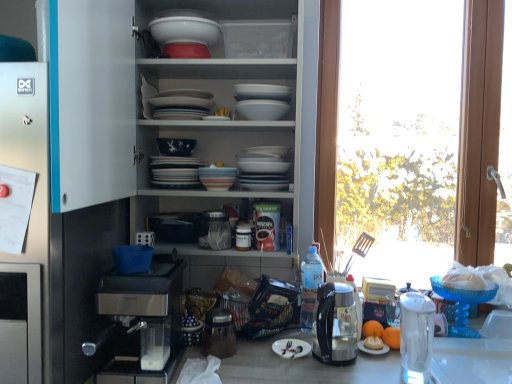
Question: Which direction should I rotate to face porcelain white bowl at center, the second bowl when ordered from front to back, — up or down?

Choices:
 (A) down
 (B) up

Answer: (B)

Question: Is the position of transparent glass window at right less distant than that of blue woven basket at lower center, the second bowl positioned from the back?

Choices:
 (A) yes
 (B) no

Answer: (B)

Question: Does transparent glass window at right appear on the right side of blue woven basket at lower center, the first bowl from the front?

Choices:
 (A) no
 (B) yes

Answer: (B)

Question: Is transparent glass window at right further to the viewer compared to blue woven basket at lower center, which ranks as the first bowl in bottom-to-top order?

Choices:
 (A) yes
 (B) no

Answer: (A)

Question: Does transparent glass window at right contain blue woven basket at lower center, placed as the second bowl when sorted from top to bottom?

Choices:
 (A) yes
 (B) no

Answer: (B)

Question: Is transparent glass window at right positioned with its back to blue woven basket at lower center, placed as the second bowl when sorted from top to bottom?

Choices:
 (A) no
 (B) yes

Answer: (A)

Question: From a real-world perspective, is transparent glass window at right physically above blue woven basket at lower center, the second bowl positioned from the back?

Choices:
 (A) no
 (B) yes

Answer: (B)

Question: From the image's perspective, is blue glass cake stand at right, which is counted as the second tableware, starting from the top, under blue fabric basket at left?

Choices:
 (A) yes
 (B) no

Answer: (A)

Question: Considering the relative sizes of blue glass cake stand at right, arranged as the first tableware when viewed from the right, and blue fabric basket at left in the image provided, is blue glass cake stand at right, arranged as the first tableware when viewed from the right, bigger than blue fabric basket at left?

Choices:
 (A) no
 (B) yes

Answer: (A)

Question: Is blue glass cake stand at right, the third tableware in the left-to-right sequence, in contact with blue fabric basket at left?

Choices:
 (A) yes
 (B) no

Answer: (B)

Question: From a real-world perspective, does blue glass cake stand at right, which is counted as the second tableware, starting from the top, stand above blue fabric basket at left?

Choices:
 (A) yes
 (B) no

Answer: (B)

Question: Is blue glass cake stand at right, arranged as the first tableware when viewed from the right, positioned with its back to blue fabric basket at left?

Choices:
 (A) yes
 (B) no

Answer: (B)

Question: Does blue glass cake stand at right, arranged as the first tableware when viewed from the right, have a smaller size compared to blue fabric basket at left?

Choices:
 (A) no
 (B) yes

Answer: (B)

Question: Considering the relative sizes of clear plastic bottle at center and pastel striped bowl at center, which is counted as the 3th tableware, starting from the bottom, in the image provided, is clear plastic bottle at center taller than pastel striped bowl at center, which is counted as the 3th tableware, starting from the bottom,?

Choices:
 (A) no
 (B) yes

Answer: (B)